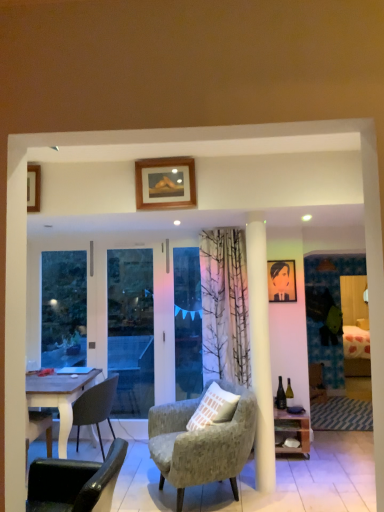
Question: Is wooden picture frame at upper center, which ranks as the second picture frame in right-to-left order, oriented towards transparent glass screen door at left?

Choices:
 (A) no
 (B) yes

Answer: (A)

Question: Is wooden picture frame at upper center, which is the second picture frame in bottom-to-top order, at the left side of transparent glass screen door at left?

Choices:
 (A) yes
 (B) no

Answer: (B)

Question: Does wooden picture frame at upper center, which is the first picture frame from front to back, contain transparent glass screen door at left?

Choices:
 (A) yes
 (B) no

Answer: (B)

Question: Does wooden picture frame at upper center, which is the first picture frame from front to back, have a larger size compared to transparent glass screen door at left?

Choices:
 (A) no
 (B) yes

Answer: (A)

Question: From a real-world perspective, does wooden picture frame at upper center, marked as the second picture frame in a back-to-front arrangement, sit lower than transparent glass screen door at left?

Choices:
 (A) no
 (B) yes

Answer: (A)

Question: Is wooden picture frame at upper center, which is the second picture frame in bottom-to-top order, placed right next to transparent glass screen door at left?

Choices:
 (A) no
 (B) yes

Answer: (A)

Question: Is wooden picture frame at upper center, which ranks as the second picture frame in right-to-left order, outside of transparent glass door at center?

Choices:
 (A) yes
 (B) no

Answer: (A)

Question: Considering the relative positions of wooden picture frame at upper center, the 1th picture frame viewed from the top, and transparent glass door at center in the image provided, is wooden picture frame at upper center, the 1th picture frame viewed from the top, in front of transparent glass door at center?

Choices:
 (A) no
 (B) yes

Answer: (B)

Question: From the image's perspective, is wooden picture frame at upper center, which is the 1th picture frame from left to right, above transparent glass door at center?

Choices:
 (A) yes
 (B) no

Answer: (A)

Question: Is wooden picture frame at upper center, which is the 1th picture frame from left to right, thinner than transparent glass door at center?

Choices:
 (A) yes
 (B) no

Answer: (B)

Question: Is wooden picture frame at upper center, marked as the second picture frame in a back-to-front arrangement, turned away from transparent glass door at center?

Choices:
 (A) yes
 (B) no

Answer: (B)

Question: Would you say wooden picture frame at upper center, which is the 1th picture frame from left to right, contains transparent glass door at center?

Choices:
 (A) yes
 (B) no

Answer: (B)

Question: From the image's perspective, does textured gray armchair at center, arranged as the second chair when viewed from the front, appear lower than green glass bottle at center-right?

Choices:
 (A) yes
 (B) no

Answer: (A)